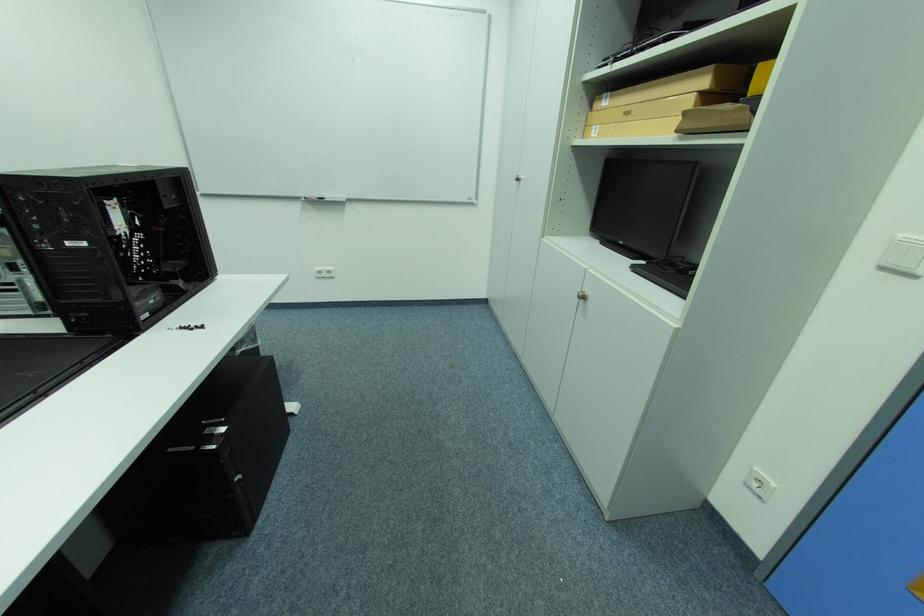
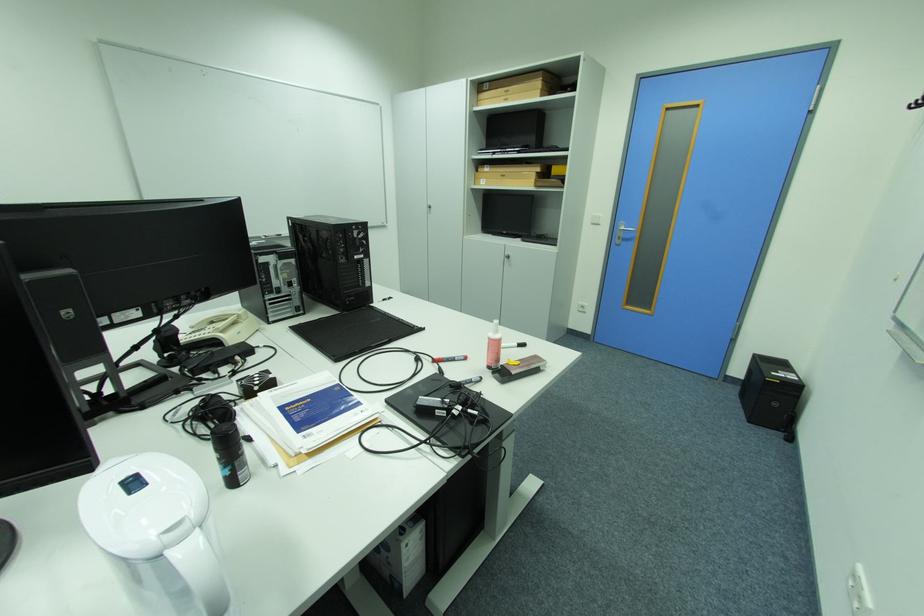
Locate, in the second image, the point that corresponds to the point at 602,128 in the first image.

(490, 180)